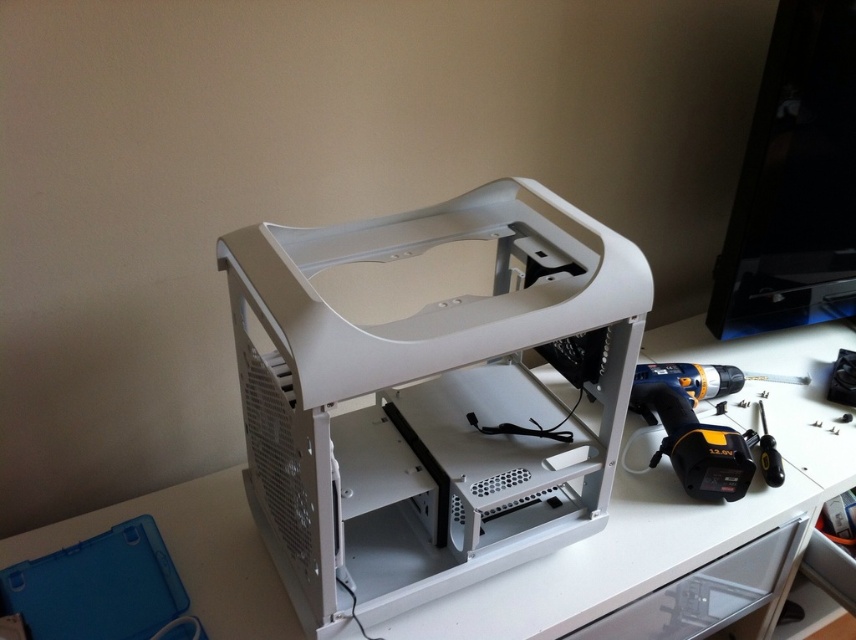
You are assembling a computer and need to place the black plastic screwdriver at lower right next to the white plastic computer case at center. Considering their sizes, will the screwdriver fit on the desk without overlapping the computer case?

The white plastic computer case at center is taller than the black plastic screwdriver at lower right, so there should be enough space on the desk to place the screwdriver next to the computer case without overlapping.

You are organizing tools on a desk and want to place the black plastic screwdriver at lower right closer to the white plastic computer case at center. Which direction should you move the screwdriver to bring it closer to the computer case?

The white plastic computer case at center is positioned on the left side of black plastic screwdriver at lower right, so to bring the screwdriver closer to the computer case, you should move it to the left.